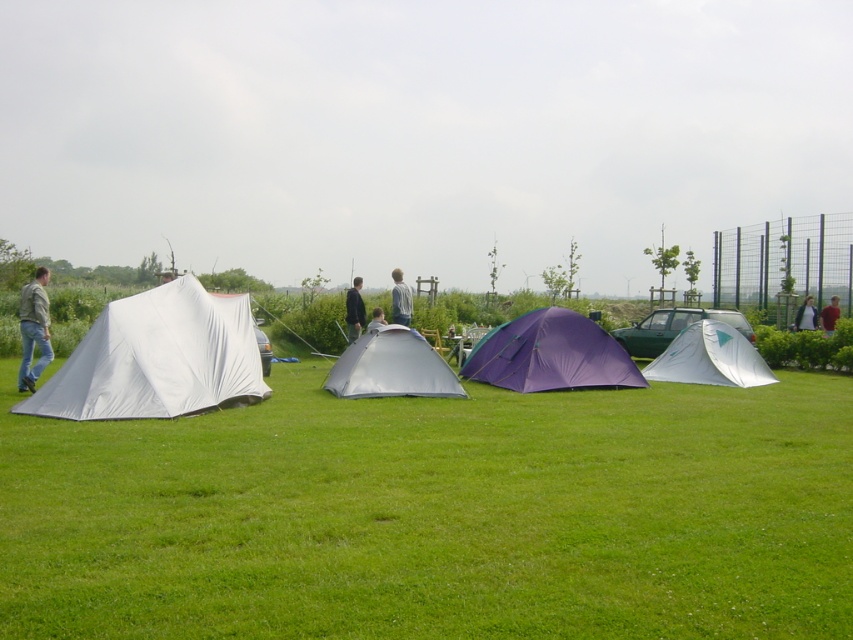
You are standing at the point with coordinates point (26, 538) and want to walk towards the point with coordinates point (370, 317). Which direction should you turn to avoid walking through the tents?

Since point (26, 538) is in front of point (370, 317), you should turn towards the tents to reach your destination without walking through them.

You are a camper who just arrived at the field and wants to set up a small tent. You notice the green grass at lower center and the light brown fabric tent at center. Which surface is more suitable for placing your tent based on their heights?

The light brown fabric tent at center is shorter than the green grass at lower center, so the light brown fabric tent at center would be a better surface for placing your tent since it is lower and likely flatter.

You are planning to set up a picnic blanket in the camping scene. The picnic blanket is 2 meters wide. You see the green grass at lower center and the light brown fabric tent at center. Which area would you choose to place the blanket so it fits entirely without overlapping any tents?

The green grass at lower center is bigger than the light brown fabric tent at center, so placing the picnic blanket on the green grass at lower center would ensure it fits entirely without overlapping any tents.